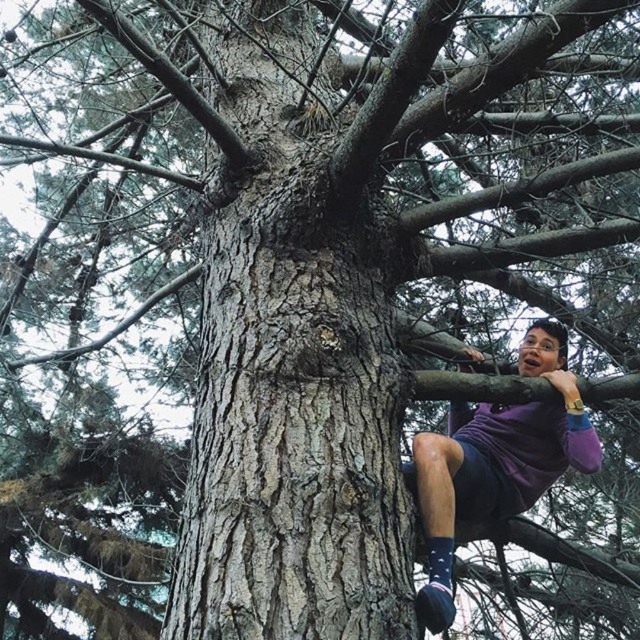
Which is in front, point (308, 310) or point (528, 369)?

Point (308, 310) is in front.

Measure the distance between smooth bark tree trunk at center and camera.

A distance of 4.94 feet exists between smooth bark tree trunk at center and camera.

I want to click on smooth bark tree trunk at center, so click(x=291, y=381).

Where is `smooth bark tree trunk at center`? smooth bark tree trunk at center is located at coordinates (291, 381).

Does smooth bark tree trunk at center have a larger size compared to blue textured sock at lower right?

Correct, smooth bark tree trunk at center is larger in size than blue textured sock at lower right.

Consider the image. Is smooth bark tree trunk at center thinner than blue textured sock at lower right?

No.

Is point (362, 161) farther from viewer compared to point (440, 564)?

That is True.

The height and width of the screenshot is (640, 640). I want to click on smooth bark tree trunk at center, so click(291, 381).

Which is above, purple cotton shirt at right or blue textured sock at lower right?

purple cotton shirt at right is above.

Which of these two, purple cotton shirt at right or blue textured sock at lower right, stands shorter?

With less height is blue textured sock at lower right.

Image resolution: width=640 pixels, height=640 pixels. Describe the element at coordinates (502, 445) in the screenshot. I see `purple cotton shirt at right` at that location.

Where is `purple cotton shirt at right`? This screenshot has width=640, height=640. purple cotton shirt at right is located at coordinates (502, 445).